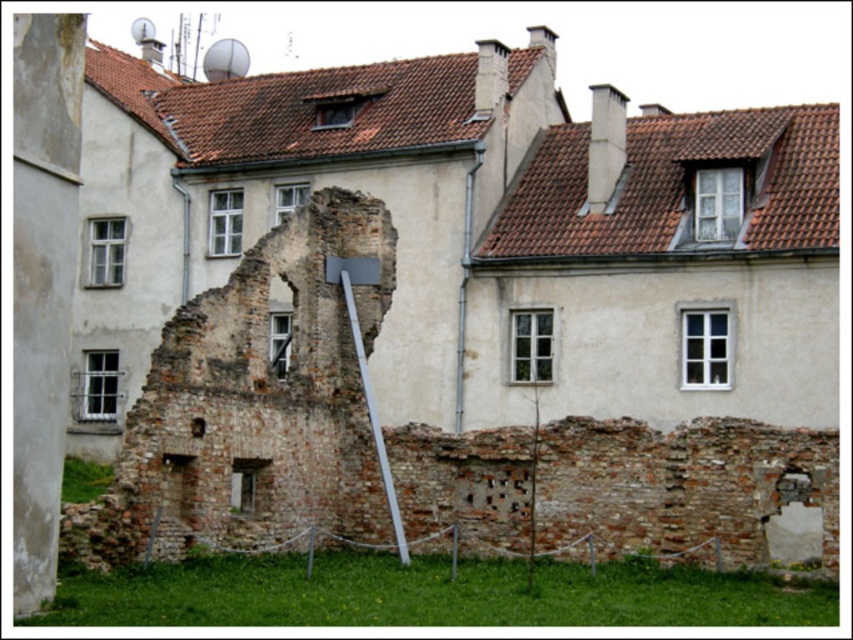
Question: Which point is farther to the camera?

Choices:
 (A) (378, 422)
 (B) (386, 524)

Answer: (A)

Question: Does brick wall at center appear under white metallic pole at center?

Choices:
 (A) no
 (B) yes

Answer: (A)

Question: Is brick wall at center in front of white metallic pole at center?

Choices:
 (A) no
 (B) yes

Answer: (B)

Question: Is brick wall at center further to the viewer compared to white metallic pole at center?

Choices:
 (A) yes
 (B) no

Answer: (B)